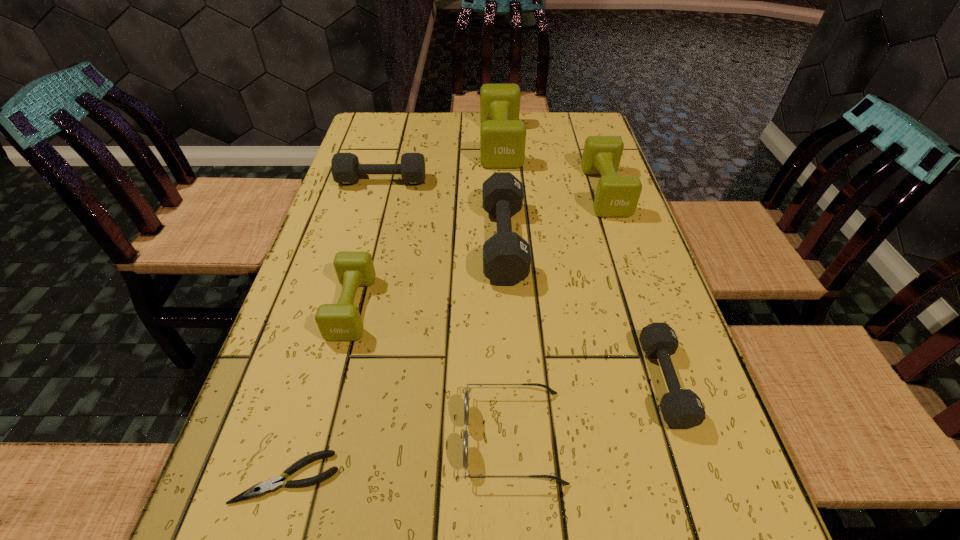
Image resolution: width=960 pixels, height=540 pixels. Identify the location of the shortest dumbbell. (681, 408).

Find the location of `sunglasses`. sunglasses is located at coordinates (466, 397).

Where is `the shortest object`? The image size is (960, 540). the shortest object is located at coordinates (273, 484).

Where is `blank space located on the front of the biggest olive dumbbell`? blank space located on the front of the biggest olive dumbbell is located at coordinates (503, 182).

Where is `free space located 0.150m on the left of the second smallest olive dumbbell`? The height and width of the screenshot is (540, 960). free space located 0.150m on the left of the second smallest olive dumbbell is located at coordinates (531, 191).

Image resolution: width=960 pixels, height=540 pixels. Find the location of `free spot located 0.350m on the back of the biggest gray dumbbell`. free spot located 0.350m on the back of the biggest gray dumbbell is located at coordinates (497, 137).

I want to click on vacant space located 0.130m on the back of the farthest gray dumbbell, so click(391, 150).

Locate an element on the screen. free space located 0.090m on the back of the nearest olive dumbbell is located at coordinates (368, 248).

Where is `free space located on the back of the nearest gray dumbbell`? free space located on the back of the nearest gray dumbbell is located at coordinates (612, 220).

The image size is (960, 540). Find the location of `free region located on the front-facing side of the sunglasses`. free region located on the front-facing side of the sunglasses is located at coordinates (244, 436).